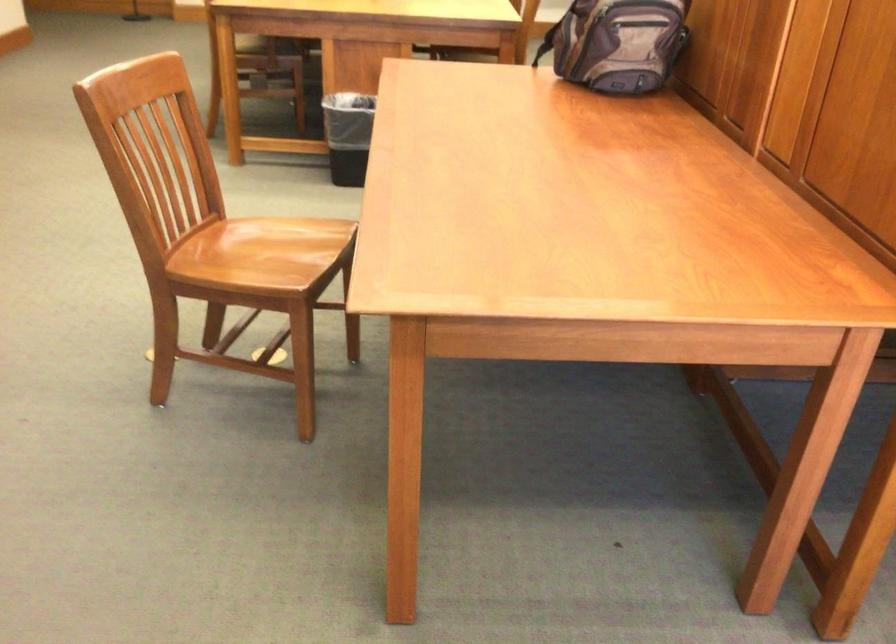
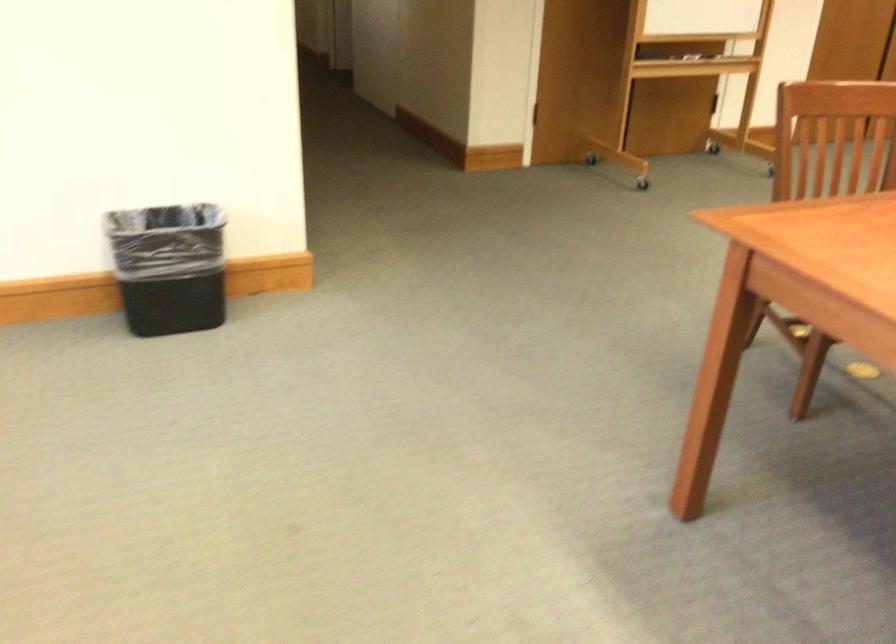
Where in the second image is the point corresponding to (428,238) from the first image?

(849, 220)